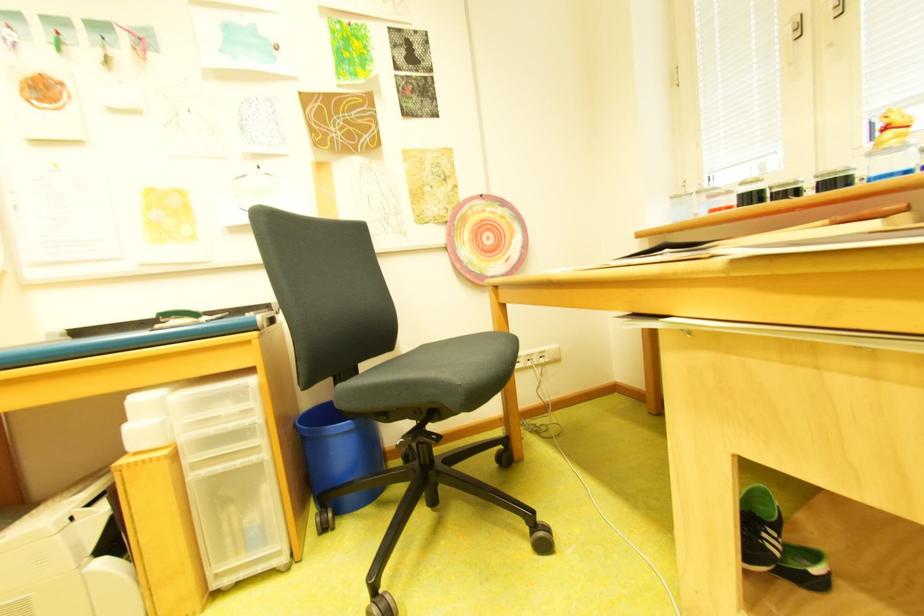
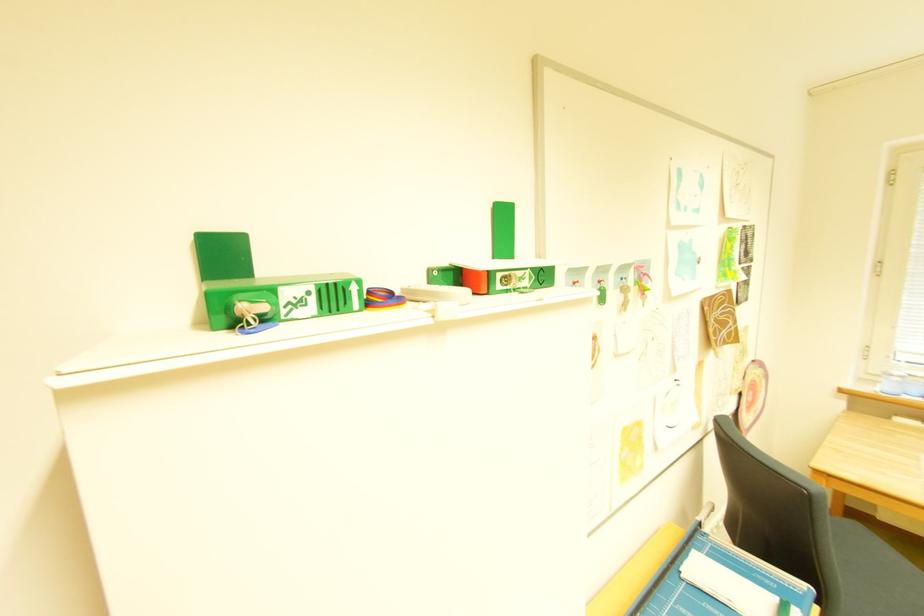
Question: The images are taken continuously from a first-person perspective. In which direction are you moving?

Choices:
 (A) Left
 (B) Right
 (C) Forward
 (D) Backward

Answer: (A)